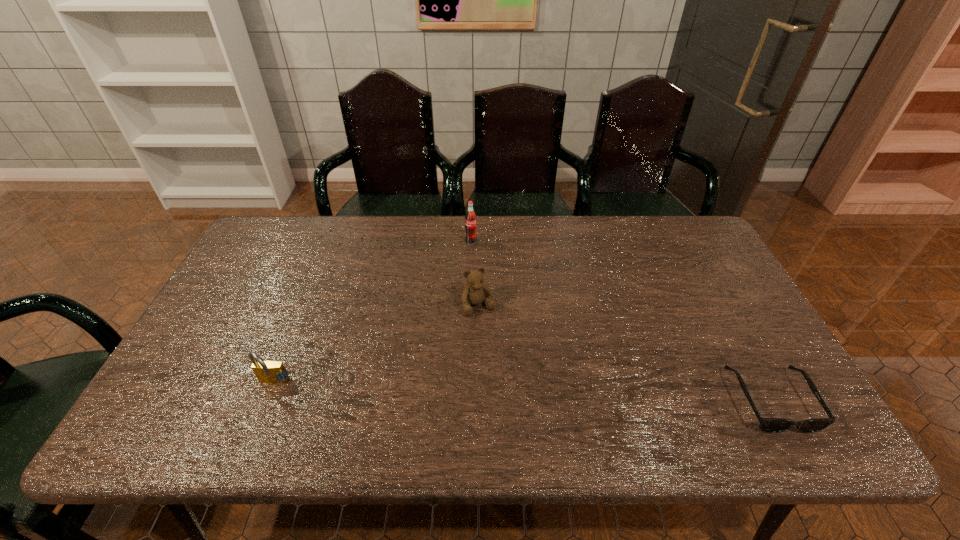
The width and height of the screenshot is (960, 540). In the image, there is a desktop. In order to click on vacant space at the right edge in this screenshot , I will do `click(724, 299)`.

At what (x,y) coordinates should I click in order to perform the action: click on vacant region at the far left corner of the desktop. Please return your answer as a coordinate pair (x, y). The height and width of the screenshot is (540, 960). Looking at the image, I should click on (255, 249).

What are the coordinates of `vacant space at the far right corner of the desktop` in the screenshot? It's located at (685, 224).

Locate an element on the screen. This screenshot has height=540, width=960. vacant area between the padlock and the teddy bear is located at coordinates pyautogui.click(x=376, y=345).

At what (x,y) coordinates should I click in order to perform the action: click on vacant area that lies between the padlock and the teddy bear. Please return your answer as a coordinate pair (x, y). This screenshot has height=540, width=960. Looking at the image, I should click on (376, 345).

I want to click on vacant point located between the padlock and the soda bottle, so click(372, 312).

Where is `empty space that is in between the farthest object and the sunglasses`? This screenshot has width=960, height=540. empty space that is in between the farthest object and the sunglasses is located at coordinates (621, 321).

Find the location of a particular element. empty location between the leftmost object and the sunglasses is located at coordinates (522, 392).

Find the location of a particular element. free area in between the sunglasses and the second farthest object is located at coordinates (625, 353).

Image resolution: width=960 pixels, height=540 pixels. Identify the location of vacant region between the rightmost object and the teddy bear. (625, 353).